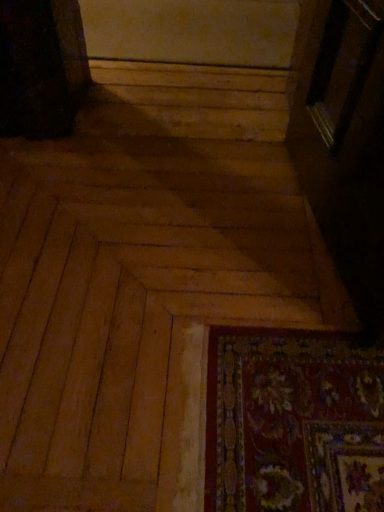
You are a GUI agent. You are given a task and a screenshot of the screen. Output one action in this format:
    pyautogui.click(x=<x>, y=<y>)
    Task: Click on the vacant space behind wooden screen door at right
    This screenshot has width=384, height=512.
    Given the screenshot: What is the action you would take?
    pyautogui.click(x=236, y=127)